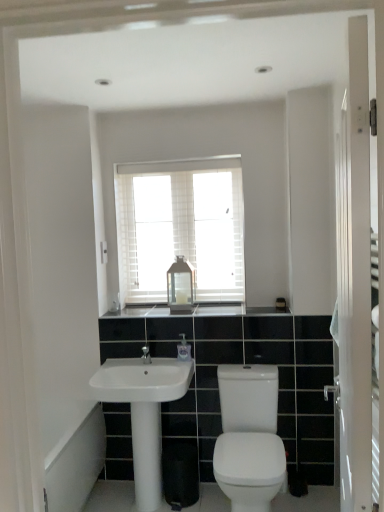
Image resolution: width=384 pixels, height=512 pixels. I want to click on white wooden blinds at upper center, so click(x=180, y=227).

What do you see at coordinates (181, 286) in the screenshot? I see `clear glass lantern at center` at bounding box center [181, 286].

What do you see at coordinates (249, 438) in the screenshot? Image resolution: width=384 pixels, height=512 pixels. I see `white glossy toilet at lower right` at bounding box center [249, 438].

Where is `white glossy bath at lower left`? white glossy bath at lower left is located at coordinates (76, 464).

Describe the element at coordinates (142, 380) in the screenshot. I see `white glossy sink at center` at that location.

This screenshot has height=512, width=384. I want to click on white glossy pedestal at center, so click(x=147, y=454).

Find the location of a particular element. The width and height of the screenshot is (384, 512). white wooden blinds at upper center is located at coordinates (180, 227).

Is translucent plastic soap dispenser at center at the back of white glossy sink at center?

That's not correct — white glossy sink at center is not looking away from translucent plastic soap dispenser at center.

From a real-world perspective, between white glossy sink at center and translucent plastic soap dispenser at center, who is vertically higher?

translucent plastic soap dispenser at center is physically above.

Locate an element on the screen. This screenshot has height=512, width=384. toiletry behind the white glossy sink at center is located at coordinates (183, 349).

Which object is further away from the camera, white glossy sink at center or translucent plastic soap dispenser at center?

translucent plastic soap dispenser at center is further away from the camera.

Who is shorter, clear glass lantern at center or white glossy bath at lower left?

clear glass lantern at center.

In the scene shown: Is clear glass lantern at center beside white glossy bath at lower left?

No, clear glass lantern at center is not in contact with white glossy bath at lower left.

Considering the sizes of clear glass lantern at center and white glossy bath at lower left in the image, is clear glass lantern at center wider or thinner than white glossy bath at lower left?

Considering their sizes, clear glass lantern at center looks slimmer than white glossy bath at lower left.

What's the angular difference between translucent plastic soap dispenser at center and white glossy sink at center's facing directions?

The angle between the facing direction of translucent plastic soap dispenser at center and the facing direction of white glossy sink at center is 0.42 degrees.

Locate an element on the screen. The width and height of the screenshot is (384, 512). sink below the translucent plastic soap dispenser at center (from a real-world perspective) is located at coordinates (142, 380).

From a real-world perspective, is translucent plastic soap dispenser at center physically located above or below white glossy sink at center?

From a real-world perspective, translucent plastic soap dispenser at center is physically above white glossy sink at center.

Is translucent plastic soap dispenser at center wider than white glossy sink at center?

No.

From the image's perspective, would you say white glossy pedestal at center is positioned over white glossy toilet at lower right?

No, from the image's perspective, white glossy pedestal at center is not above white glossy toilet at lower right.

Which is more to the left, white glossy pedestal at center or white glossy toilet at lower right?

white glossy pedestal at center is more to the left.

Is white glossy pedestal at center wider than white glossy toilet at lower right?

Incorrect, the width of white glossy pedestal at center does not surpass that of white glossy toilet at lower right.

Can white glossy toilet at lower right be found inside white glossy pedestal at center?

No, white glossy toilet at lower right is not inside white glossy pedestal at center.

From a real-world perspective, is clear glass lantern at center physically located above or below white glossy sink at center?

Clearly, from a real-world perspective, clear glass lantern at center is above white glossy sink at center.

Does clear glass lantern at center have a larger size compared to white glossy sink at center?

Actually, clear glass lantern at center might be smaller than white glossy sink at center.

Looking at this image, between clear glass lantern at center and white glossy sink at center, which one has less height?

white glossy sink at center.

Locate an element on the screen. This screenshot has height=512, width=384. medicine cabinet located above the white glossy sink at center (from a real-world perspective) is located at coordinates (x=181, y=286).

Based on the photo, from the image's perspective, which is below, white glossy sink at center or white glossy bath at lower left?

white glossy bath at lower left is shown below in the image.

This screenshot has height=512, width=384. I want to click on bath that appears in front of the white glossy sink at center, so click(76, 464).

Considering the positions of objects white glossy sink at center and white glossy bath at lower left in the image provided, who is more to the right, white glossy sink at center or white glossy bath at lower left?

white glossy sink at center is more to the right.

Is white glossy sink at center positioned before white glossy bath at lower left?

No, white glossy sink at center is further to the viewer.

Is white glossy sink at center not near white wooden blinds at upper center?

They are positioned close to each other.

Image resolution: width=384 pixels, height=512 pixels. Identify the location of sink directly beneath the white wooden blinds at upper center (from a real-world perspective). (142, 380).

Could you tell me if white glossy sink at center is turned towards white wooden blinds at upper center?

No, white glossy sink at center is not aimed at white wooden blinds at upper center.

Who is taller, white glossy sink at center or white wooden blinds at upper center?

white wooden blinds at upper center.

What are the coordinates of `sink below the translucent plastic soap dispenser at center (from the image's perspective)` in the screenshot? It's located at (142, 380).

The height and width of the screenshot is (512, 384). Find the location of `medicine cabinet above the white glossy bath at lower left (from the image's perspective)`. medicine cabinet above the white glossy bath at lower left (from the image's perspective) is located at coordinates (181, 286).

Which object lies nearer to the anchor point translucent plastic soap dispenser at center, white wooden blinds at upper center or white glossy bath at lower left?

Based on the image, white wooden blinds at upper center appears to be nearer to translucent plastic soap dispenser at center.

Based on the photo, from the image, which object appears to be nearer to white glossy sink at center, white glossy pedestal at center or black granite countertop at center?

Among the two, white glossy pedestal at center is located nearer to white glossy sink at center.

Which object lies further to the anchor point translucent plastic soap dispenser at center, white glossy sink at center or clear glass lantern at center?

Among the two, clear glass lantern at center is located further to translucent plastic soap dispenser at center.

Considering their positions, is white wooden blinds at upper center positioned further to clear glass lantern at center than white glossy toilet at lower right?

white glossy toilet at lower right lies further to clear glass lantern at center than the other object.

From the image, which object appears to be nearer to black granite countertop at center, white glossy toilet at lower right or white glossy sink at center?

Among the two, white glossy sink at center is located nearer to black granite countertop at center.

Looking at the image, which one is located closer to white glossy bath at lower left, clear glass lantern at center or translucent plastic soap dispenser at center?

translucent plastic soap dispenser at center is positioned closer to the anchor white glossy bath at lower left.

Based on their spatial positions, is white glossy sink at center or white glossy toilet at lower right further from white wooden blinds at upper center?

white glossy toilet at lower right is positioned further to the anchor white wooden blinds at upper center.

When comparing their distances from white glossy pedestal at center, does white glossy toilet at lower right or white glossy bath at lower left seem further?

white glossy toilet at lower right lies further to white glossy pedestal at center than the other object.

Where is `counter top located between white glossy screen door at right and white wooden blinds at upper center in the depth direction`? counter top located between white glossy screen door at right and white wooden blinds at upper center in the depth direction is located at coordinates (237, 310).

At what (x,y) coordinates should I click in order to perform the action: click on counter top between white wooden blinds at upper center and white glossy sink at center from top to bottom. Please return your answer as a coordinate pair (x, y). Looking at the image, I should click on (237, 310).

The height and width of the screenshot is (512, 384). Identify the location of sink between white glossy screen door at right and white wooden blinds at upper center in the front-back direction. point(142,380).

The width and height of the screenshot is (384, 512). Find the location of `sink that lies between black granite countertop at center and white glossy toilet at lower right from top to bottom`. sink that lies between black granite countertop at center and white glossy toilet at lower right from top to bottom is located at coordinates (142, 380).